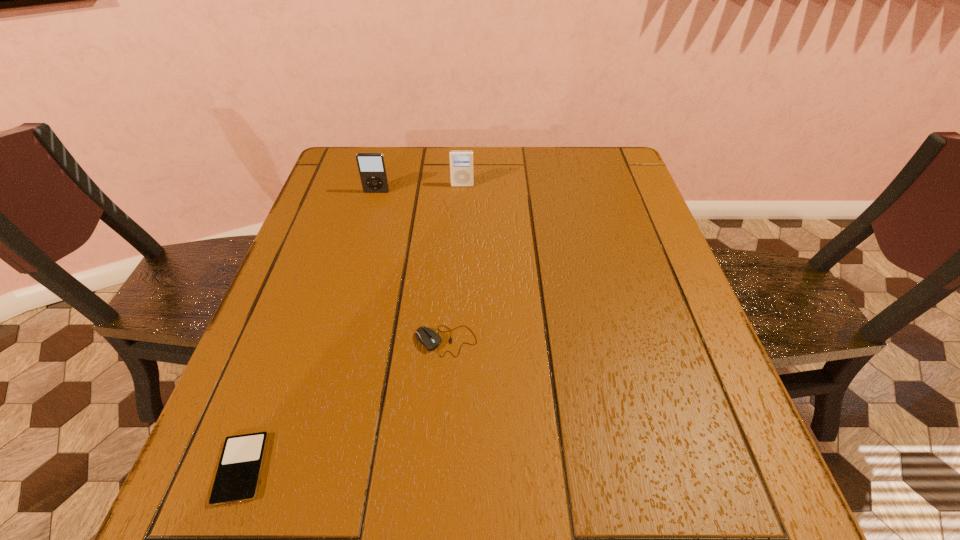
At what (x,y) coordinates should I click in order to perform the action: click on the second iPod from right to left. Please return your answer as a coordinate pair (x, y). Looking at the image, I should click on (371, 166).

You are a GUI agent. You are given a task and a screenshot of the screen. Output one action in this format:
    pyautogui.click(x=<x>, y=<y>)
    Task: Click on the third nearest object
    
    Given the screenshot: What is the action you would take?
    pyautogui.click(x=371, y=166)

Where is `the farthest iPod`? the farthest iPod is located at coordinates (461, 161).

At what (x,y) coordinates should I click in order to perform the action: click on the farthest object. Please return your answer as a coordinate pair (x, y). Looking at the image, I should click on pyautogui.click(x=461, y=161).

Locate an element on the screen. the third farthest object is located at coordinates click(x=429, y=338).

You are a GUI agent. You are given a task and a screenshot of the screen. Output one action in this format:
    pyautogui.click(x=<x>, y=<y>)
    Task: Click on the computer mouse
    Image resolution: width=960 pixels, height=540 pixels.
    Given the screenshot: What is the action you would take?
    pyautogui.click(x=429, y=338)

In order to click on the shortest iPod in this screenshot , I will do `click(238, 474)`.

Locate an element on the screen. the shortest object is located at coordinates (238, 474).

This screenshot has height=540, width=960. I want to click on free space located 0.400m on the front-facing side of the second iPod from left to right, so click(346, 303).

The image size is (960, 540). I want to click on vacant space located 0.310m on the front-facing side of the farthest object, so click(x=459, y=265).